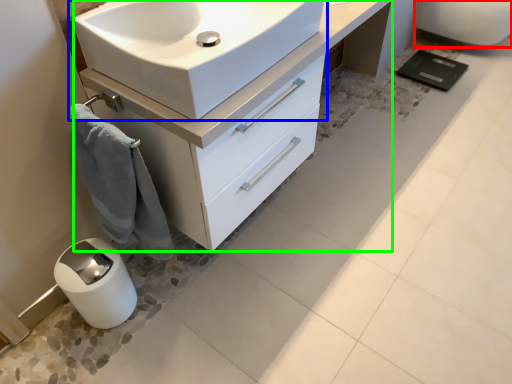
Question: Which is farther away from porcelain (highlighted by a red box)? sink (highlighted by a blue box) or bathroom cabinet (highlighted by a green box)?

Choices:
 (A) sink
 (B) bathroom cabinet

Answer: (A)